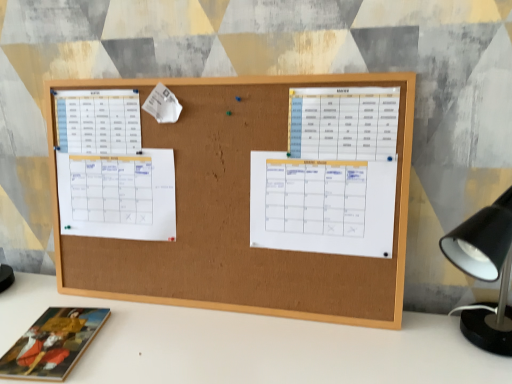
Question: Can you confirm if white paper calendar at center, arranged as the 1th list when viewed from the right, is taller than white paper calendar at left, the third list when ordered from right to left?

Choices:
 (A) yes
 (B) no

Answer: (B)

Question: Does white paper calendar at center, arranged as the 1th list when viewed from the right, have a lesser height compared to white paper calendar at left, the third list when ordered from right to left?

Choices:
 (A) no
 (B) yes

Answer: (B)

Question: Is white paper calendar at left, which ranks as the 2th list in left-to-right order, a part of white paper calendar at center, which ranks as the 4th list in left-to-right order?

Choices:
 (A) yes
 (B) no

Answer: (B)

Question: Can you confirm if white paper calendar at center, arranged as the 1th list when viewed from the right, is smaller than white paper calendar at left, the third list when ordered from right to left?

Choices:
 (A) yes
 (B) no

Answer: (A)

Question: Is white paper calendar at center, arranged as the 1th list when viewed from the right, further to camera compared to white paper calendar at left, which ranks as the 2th list in left-to-right order?

Choices:
 (A) no
 (B) yes

Answer: (A)

Question: From the image's perspective, relative to wooden book at lower left, is white paper calendar at left, the third list when ordered from right to left, above or below?

Choices:
 (A) below
 (B) above

Answer: (B)

Question: Relative to wooden book at lower left, is white paper calendar at left, the third list when ordered from right to left, in front or behind?

Choices:
 (A) behind
 (B) front

Answer: (A)

Question: Does point (117, 233) appear closer or farther from the camera than point (39, 352)?

Choices:
 (A) closer
 (B) farther

Answer: (B)

Question: Looking at their shapes, would you say white paper calendar at left, the third list when ordered from right to left, is wider or thinner than wooden book at lower left?

Choices:
 (A) wide
 (B) thin

Answer: (B)

Question: Is white paper calendar at left, the third list when ordered from right to left, taller or shorter than white paper calendar at center, arranged as the 1th list when viewed from the right?

Choices:
 (A) short
 (B) tall

Answer: (B)

Question: Looking at the image, does white paper calendar at left, which ranks as the 2th list in left-to-right order, seem bigger or smaller compared to white paper calendar at center, which ranks as the 4th list in left-to-right order?

Choices:
 (A) small
 (B) big

Answer: (B)

Question: From the image's perspective, relative to white paper calendar at center, arranged as the 1th list when viewed from the right, is white paper calendar at left, which ranks as the 2th list in left-to-right order, above or below?

Choices:
 (A) below
 (B) above

Answer: (A)

Question: Considering the relative positions of white paper calendar at left, which ranks as the 2th list in left-to-right order, and white paper calendar at center, arranged as the 1th list when viewed from the right, in the image provided, is white paper calendar at left, which ranks as the 2th list in left-to-right order, to the left or to the right of white paper calendar at center, arranged as the 1th list when viewed from the right,?

Choices:
 (A) right
 (B) left

Answer: (B)

Question: Is wooden book at lower left situated inside white paper at left, which ranks as the first list in left-to-right order, or outside?

Choices:
 (A) outside
 (B) inside

Answer: (A)

Question: From a real-world perspective, is wooden book at lower left positioned above or below white paper at left, which is counted as the fourth list, starting from the right?

Choices:
 (A) below
 (B) above

Answer: (A)